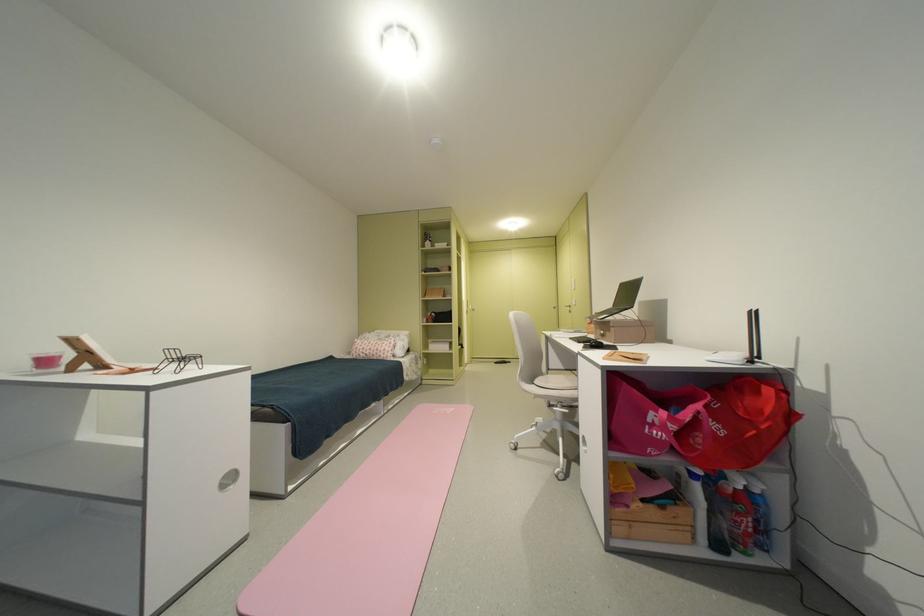
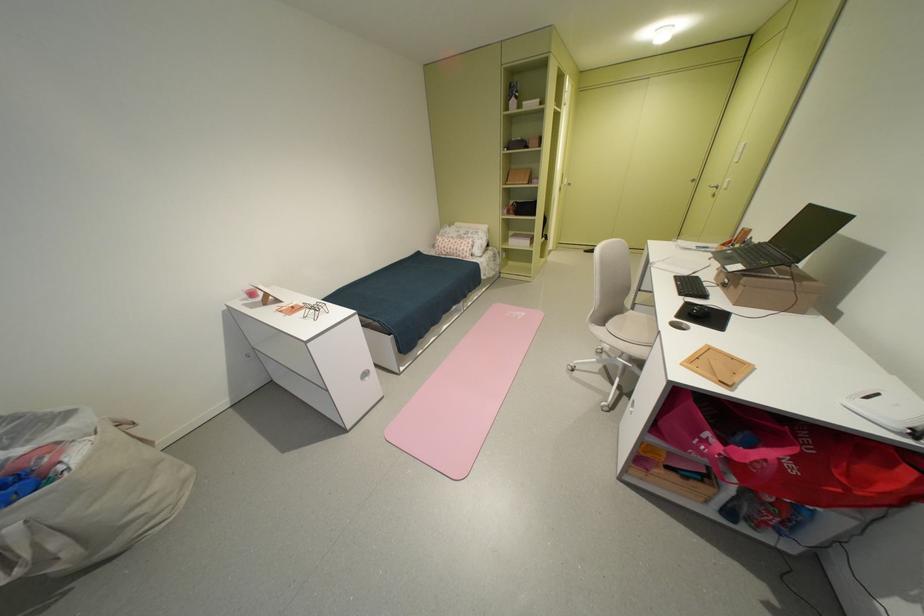
The point at (458, 411) is marked in the first image. Where is the corresponding point in the second image?

(530, 315)